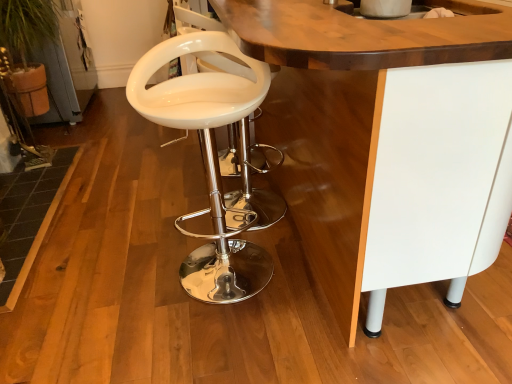
Question: Is the position of white glossy bar stool at center more distant than that of white glossy sink at upper center?

Choices:
 (A) no
 (B) yes

Answer: (A)

Question: Is white glossy bar stool at center to the left of white glossy sink at upper center from the viewer's perspective?

Choices:
 (A) yes
 (B) no

Answer: (A)

Question: Does white glossy bar stool at center come in front of white glossy sink at upper center?

Choices:
 (A) no
 (B) yes

Answer: (B)

Question: Is white glossy bar stool at center smaller than white glossy sink at upper center?

Choices:
 (A) no
 (B) yes

Answer: (A)

Question: Is white glossy bar stool at center oriented away from white glossy sink at upper center?

Choices:
 (A) yes
 (B) no

Answer: (B)

Question: Is point (505, 200) positioned closer to the camera than point (352, 4)?

Choices:
 (A) farther
 (B) closer

Answer: (B)

Question: From a real-world perspective, is white glossy table at center physically located above or below white glossy sink at upper center?

Choices:
 (A) above
 (B) below

Answer: (B)

Question: In terms of height, does white glossy table at center look taller or shorter compared to white glossy sink at upper center?

Choices:
 (A) short
 (B) tall

Answer: (B)

Question: Is white glossy table at center bigger or smaller than white glossy sink at upper center?

Choices:
 (A) small
 (B) big

Answer: (B)

Question: Relative to white glossy table at center, is white glossy sink at upper center in front or behind?

Choices:
 (A) front
 (B) behind

Answer: (B)

Question: In terms of size, does white glossy sink at upper center appear bigger or smaller than white glossy table at center?

Choices:
 (A) small
 (B) big

Answer: (A)

Question: Considering the positions of point (495, 11) and point (489, 228), is point (495, 11) closer or farther from the camera than point (489, 228)?

Choices:
 (A) closer
 (B) farther

Answer: (A)

Question: From a real-world perspective, relative to white glossy table at center, is white glossy sink at upper center vertically above or below?

Choices:
 (A) below
 (B) above

Answer: (B)

Question: From a real-world perspective, relative to white glossy table at center, is white glossy bar stool at center vertically above or below?

Choices:
 (A) above
 (B) below

Answer: (B)

Question: In the image, is white glossy bar stool at center on the left side or the right side of white glossy table at center?

Choices:
 (A) right
 (B) left

Answer: (B)